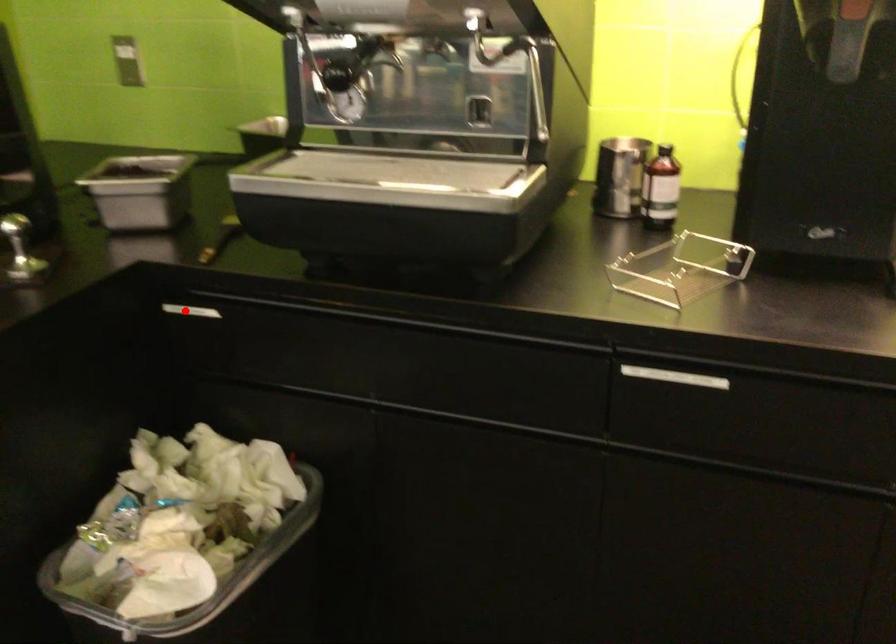
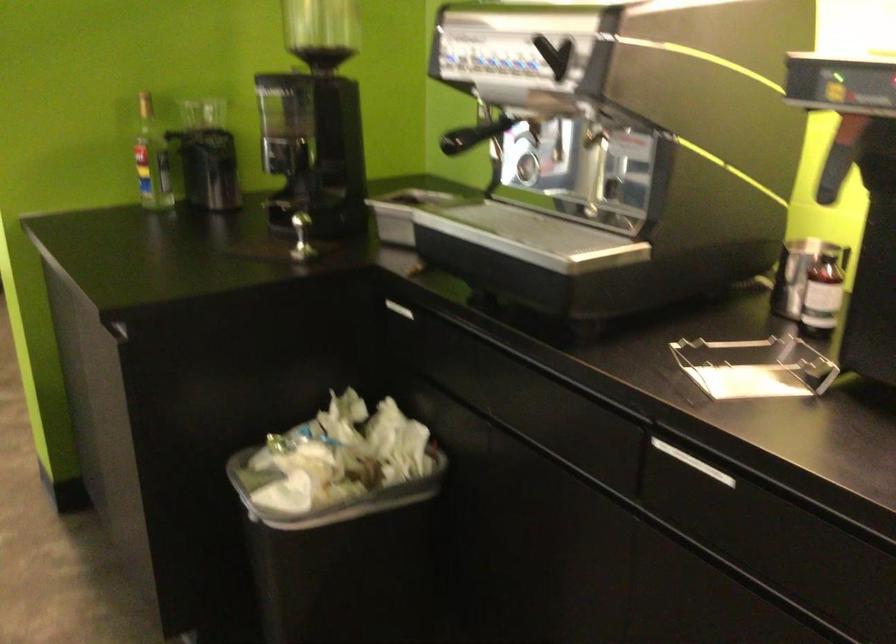
In the second image, find the point that corresponds to the highlighted location in the first image.

(394, 308)